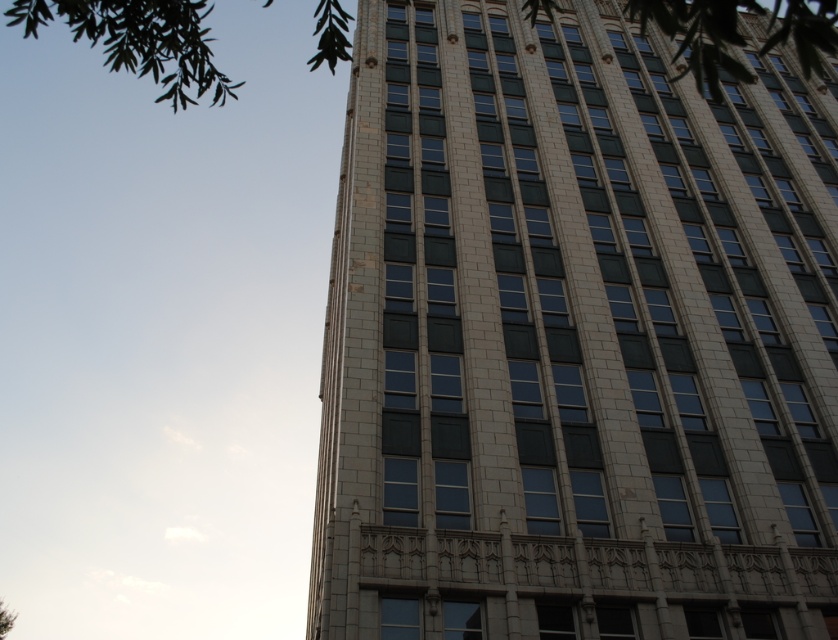
Question: From the image, what is the correct spatial relationship of white stone building at center in relation to green leafy tree at lower left?

Choices:
 (A) below
 (B) above

Answer: (B)

Question: Which point is farther to the camera?

Choices:
 (A) green leafy tree at lower left
 (B) green leafy tree at upper left
 (C) white stone building at center

Answer: (A)

Question: Based on their relative distances, which object is farther from the white stone building at center?

Choices:
 (A) green leafy tree at upper left
 (B) green leafy tree at lower left

Answer: (B)

Question: Is white stone building at center above green leafy tree at lower left?

Choices:
 (A) yes
 (B) no

Answer: (A)

Question: Is green leafy tree at upper left closer to the viewer compared to green leafy tree at lower left?

Choices:
 (A) no
 (B) yes

Answer: (B)

Question: Considering the real-world distances, which object is farthest from the green leafy tree at lower left?

Choices:
 (A) green leafy tree at upper left
 (B) white stone building at center

Answer: (A)